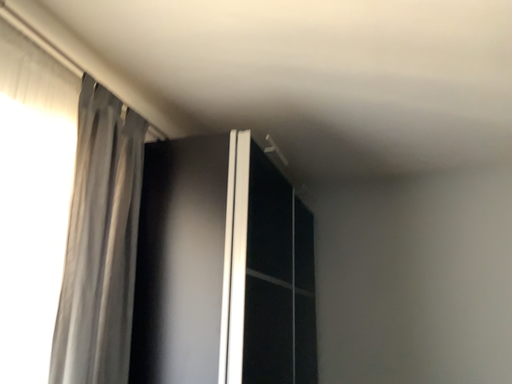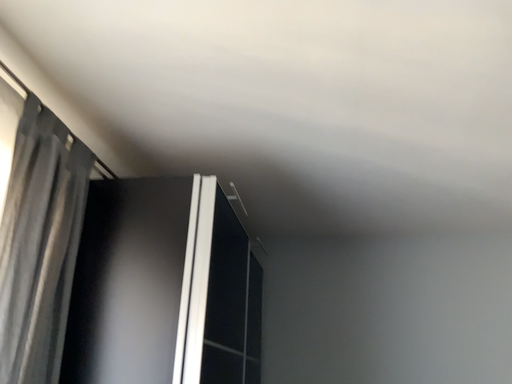
Question: Which way did the camera rotate in the video?

Choices:
 (A) rotated left
 (B) rotated right

Answer: (B)